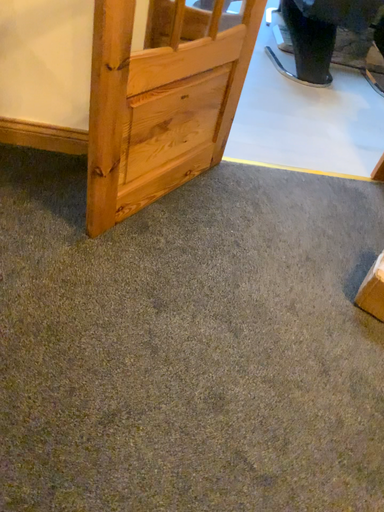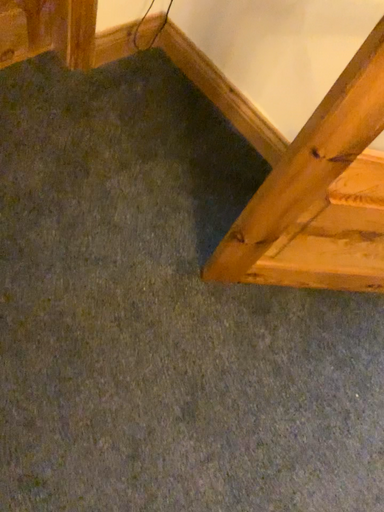
Question: Which way did the camera rotate in the video?

Choices:
 (A) rotated right
 (B) rotated left

Answer: (B)